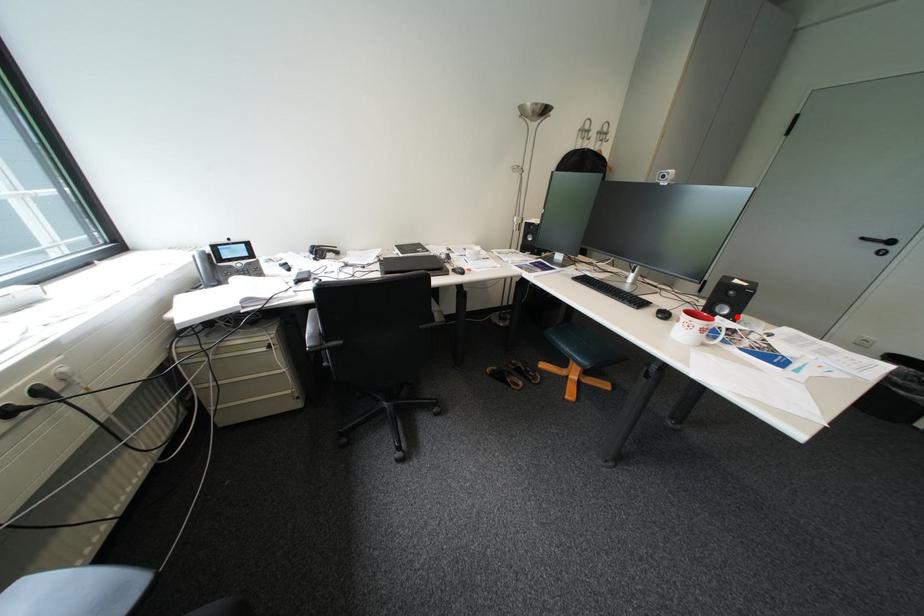
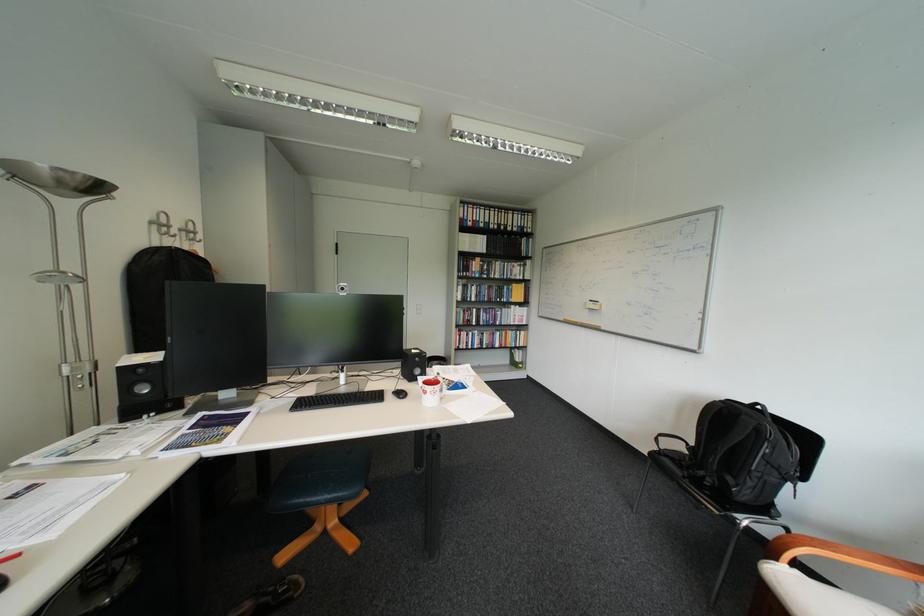
Where in the second image is the point corresponding to the highlighted location from the first image?

(432, 376)